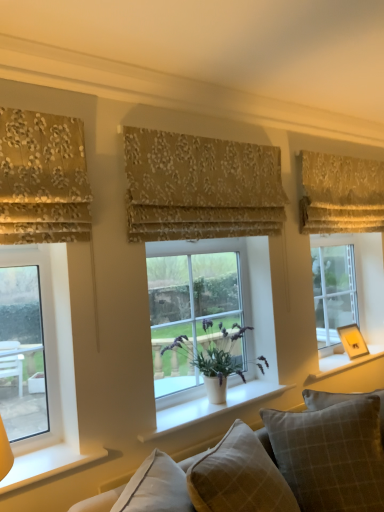
Question: Which direction should I rotate to look at plaid fabric pillow at center, marked as the second pillow in a right-to-left arrangement?

Choices:
 (A) left
 (B) right

Answer: (B)

Question: Considering the relative sizes of gold floral fabric at upper right, the 1th curtain viewed from the back, and gold floral fabric at upper left, the third curtain when ordered from back to front, in the image provided, is gold floral fabric at upper right, the 1th curtain viewed from the back, smaller than gold floral fabric at upper left, the third curtain when ordered from back to front,?

Choices:
 (A) no
 (B) yes

Answer: (A)

Question: Is the depth of gold floral fabric at upper right, which is the 3th curtain from front to back, less than that of gold floral fabric at upper left, marked as the first curtain in a left-to-right arrangement?

Choices:
 (A) no
 (B) yes

Answer: (A)

Question: Is gold floral fabric at upper right, which is the 3th curtain from front to back, further to the viewer compared to gold floral fabric at upper left, the third curtain when ordered from back to front?

Choices:
 (A) no
 (B) yes

Answer: (B)

Question: Does gold floral fabric at upper right, which is the 3th curtain from front to back, have a lesser height compared to gold floral fabric at upper left, placed as the 3th curtain when sorted from right to left?

Choices:
 (A) yes
 (B) no

Answer: (A)

Question: Would you say gold floral fabric at upper right, which is the 3th curtain from front to back, is a long distance from gold floral fabric at upper left, placed as the 3th curtain when sorted from right to left?

Choices:
 (A) yes
 (B) no

Answer: (A)

Question: Is gold floral fabric at upper right, the 1th curtain viewed from the back, looking in the opposite direction of gold floral fabric at upper left, the third curtain when ordered from back to front?

Choices:
 (A) no
 (B) yes

Answer: (A)

Question: Considering the relative positions of clear glass window at left, which is the third window from back to front, and white smooth window sill at center, the second window sill when ordered from front to back, in the image provided, is clear glass window at left, which is the third window from back to front, behind white smooth window sill at center, the second window sill when ordered from front to back,?

Choices:
 (A) yes
 (B) no

Answer: (B)

Question: Does clear glass window at left, which appears as the first window when viewed from the left, have a larger size compared to white smooth window sill at center, placed as the second window sill when sorted from back to front?

Choices:
 (A) yes
 (B) no

Answer: (A)

Question: From the image's perspective, is clear glass window at left, arranged as the first window when viewed from the front, on top of white smooth window sill at center, placed as the second window sill when sorted from back to front?

Choices:
 (A) no
 (B) yes

Answer: (B)

Question: Is clear glass window at left, arranged as the first window when viewed from the front, at the right side of white smooth window sill at center, placed as the second window sill when sorted from back to front?

Choices:
 (A) no
 (B) yes

Answer: (A)

Question: Can you confirm if clear glass window at left, arranged as the first window when viewed from the front, is smaller than white smooth window sill at center, the second window sill from the left?

Choices:
 (A) no
 (B) yes

Answer: (A)

Question: Is clear glass window at left, arranged as the first window when viewed from the front, outside of white smooth window sill at center, the second window sill from the left?

Choices:
 (A) no
 (B) yes

Answer: (B)

Question: Is plaid fabric pillow at lower right, which is counted as the first pillow, starting from the right, oriented towards clear glass window at right, the 3th window positioned from the left?

Choices:
 (A) no
 (B) yes

Answer: (A)